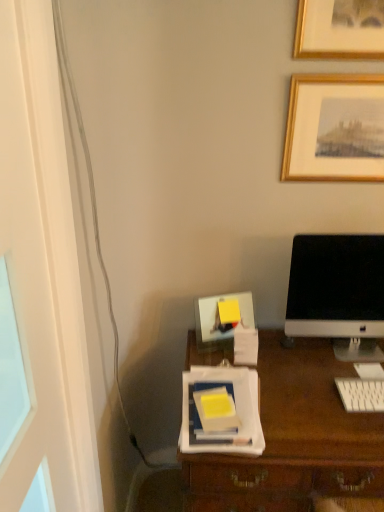
Question: Is white glossy computer monitor at right to the left or to the right of gold wooden picture frame at upper right in the image?

Choices:
 (A) right
 (B) left

Answer: (A)

Question: Considering the positions of white glossy computer monitor at right and gold wooden picture frame at upper right in the image, is white glossy computer monitor at right taller or shorter than gold wooden picture frame at upper right?

Choices:
 (A) short
 (B) tall

Answer: (B)

Question: Estimate the real-world distances between objects in this image. Which object is farther from the white glossy computer monitor at right?

Choices:
 (A) transparent glass door at left
 (B) yellow matte notebook at center
 (C) gold wooden picture frame at upper right
 (D) white plastic keyboard at lower right

Answer: (A)

Question: Based on their relative distances, which object is farther from the white plastic keyboard at lower right?

Choices:
 (A) yellow matte notebook at center
 (B) transparent glass door at left
 (C) white glossy computer monitor at right
 (D) gold wooden picture frame at upper right

Answer: (B)